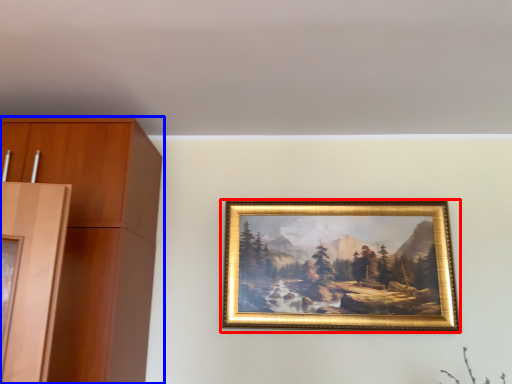
Question: Which object is closer to the camera taking this photo, picture frame (highlighted by a red box) or cabinetry (highlighted by a blue box)?

Choices:
 (A) picture frame
 (B) cabinetry

Answer: (B)